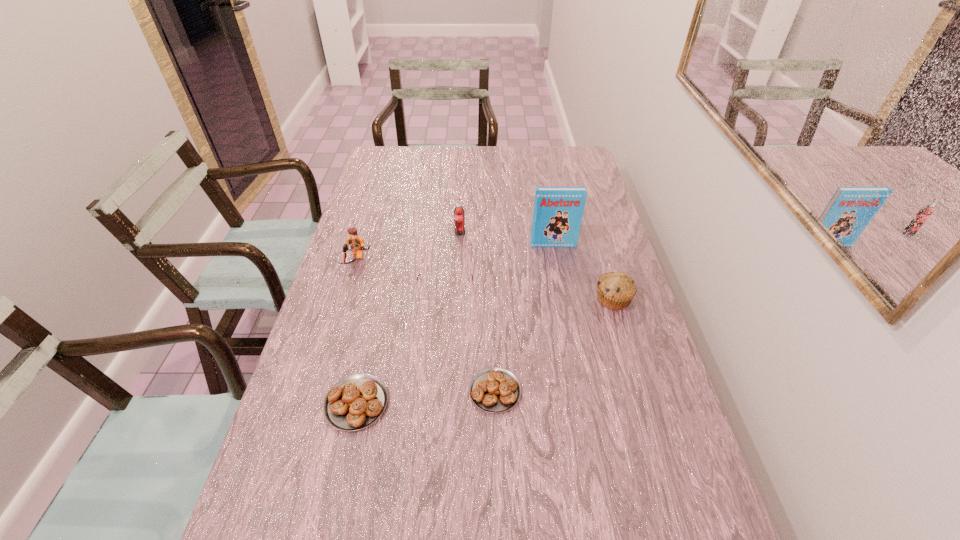
What are the coordinates of `pastry located at the left edge` in the screenshot? It's located at (355, 402).

Image resolution: width=960 pixels, height=540 pixels. In order to click on Lego that is at the left edge in this screenshot , I will do `click(354, 243)`.

Where is `book that is at the right edge`? book that is at the right edge is located at coordinates (558, 211).

Find the location of `muffin situated at the right edge`. muffin situated at the right edge is located at coordinates (615, 290).

Identify the location of free region at the far edge of the desktop. (540, 172).

In order to click on blank area at the near edge in this screenshot , I will do `click(592, 504)`.

In order to click on vacant space at the left edge of the desktop in this screenshot , I will do `click(369, 224)`.

The width and height of the screenshot is (960, 540). Find the location of `vacant space at the right edge`. vacant space at the right edge is located at coordinates (555, 181).

Locate an element on the screen. vacant space at the far left corner of the desktop is located at coordinates (384, 164).

Locate an element on the screen. This screenshot has width=960, height=540. free location at the near left corner of the desktop is located at coordinates pyautogui.click(x=261, y=496).